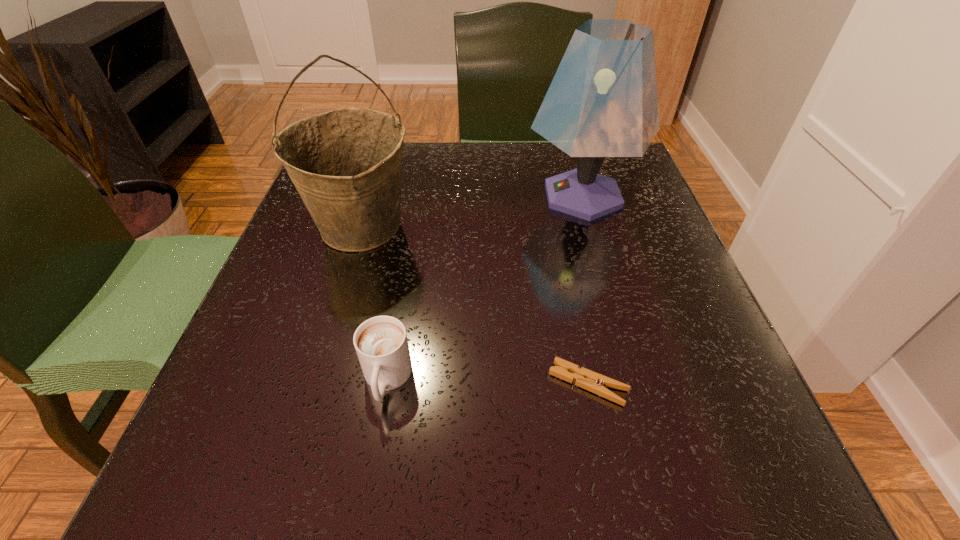
Where is `lampshade that is at the far edge`? lampshade that is at the far edge is located at coordinates (602, 102).

Identify the location of wine bucket that is at the far edge. The image size is (960, 540). (346, 164).

This screenshot has width=960, height=540. In order to click on object at the left edge in this screenshot , I will do `click(346, 164)`.

This screenshot has height=540, width=960. Find the location of `lampshade that is positioned at the right edge`. lampshade that is positioned at the right edge is located at coordinates (602, 102).

You are a GUI agent. You are given a task and a screenshot of the screen. Output one action in this format:
    pyautogui.click(x=<x>, y=<y>)
    Task: Click on the clothespin that is at the right edge
    This screenshot has width=960, height=540.
    Given the screenshot: What is the action you would take?
    pyautogui.click(x=596, y=383)

Find the location of a particular element. The height and width of the screenshot is (540, 960). object located in the far left corner section of the desktop is located at coordinates (346, 164).

Locate an element on the screen. Image resolution: width=960 pixels, height=540 pixels. object situated at the far right corner is located at coordinates (602, 102).

This screenshot has height=540, width=960. I want to click on vacant space at the far edge of the desktop, so click(447, 191).

I want to click on vacant point at the near edge, so click(x=428, y=447).

The width and height of the screenshot is (960, 540). I want to click on vacant space at the left edge of the desktop, so click(x=288, y=237).